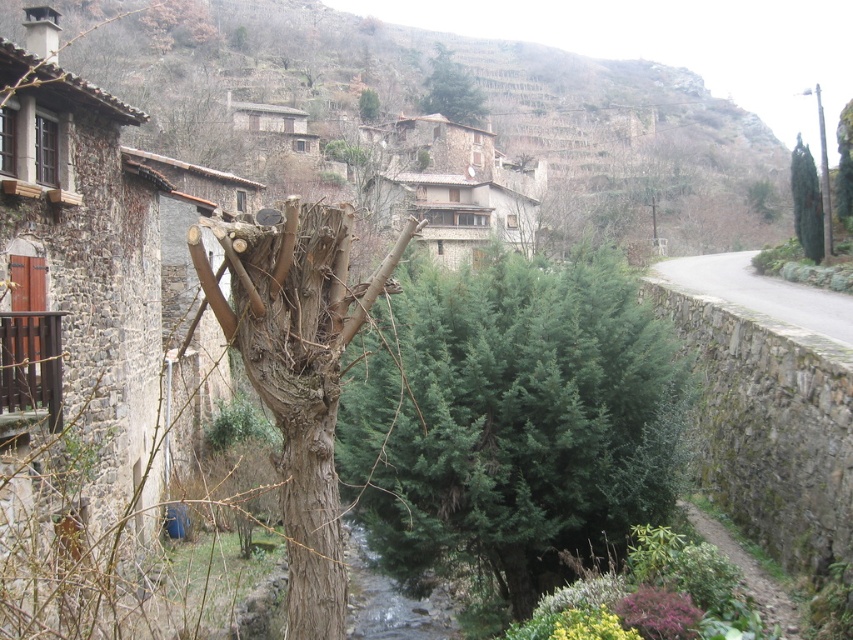
You are a hiker planning to take a photo of the gray stone wall at right and the green textured tree at upper center. Based on their positions, which object should appear higher in your camera frame?

The green textured tree at upper center should appear higher in the camera frame since it is positioned above the gray stone wall at right.

In the scene shown: You are standing in the village scene and want to walk towards the point marked at coordinates point (x=769, y=294). How far will you have to walk to reach that point?

The distance between you and the point (x=769, y=294) is 27.06 meters, so you will have to walk 27.06 meters to reach it.

You are navigating a mountain path and see the green textured tree at upper center. Based on its position, can you determine if it is closer to the weathered stone wall on the right or the narrow paved road on the left?

The green textured tree at upper center is located at point [451,90]. Since the coordinates place it closer to the right side of the image, it is nearer to the weathered stone wall on the right than the narrow paved road on the left.